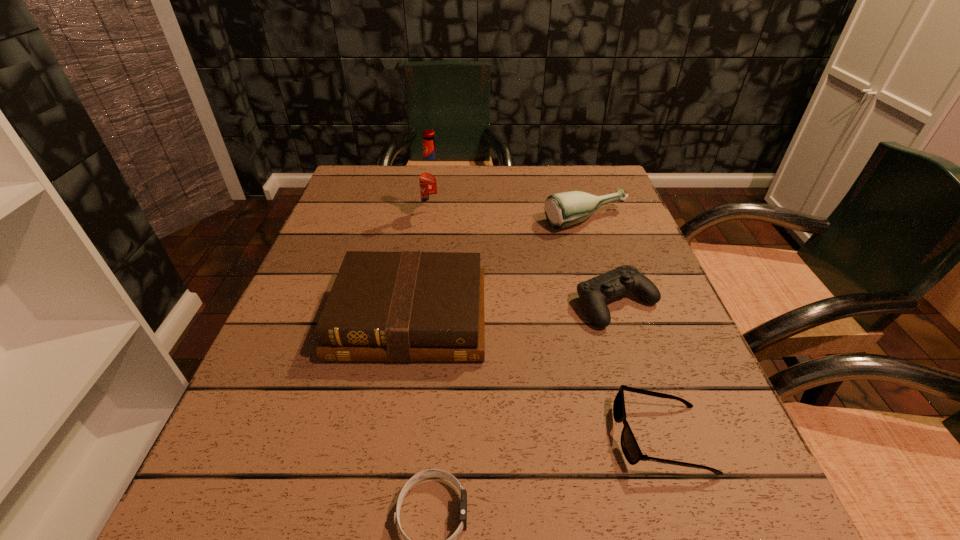
The width and height of the screenshot is (960, 540). Find the location of `the third closest object to the tallest object`. the third closest object to the tallest object is located at coordinates (594, 293).